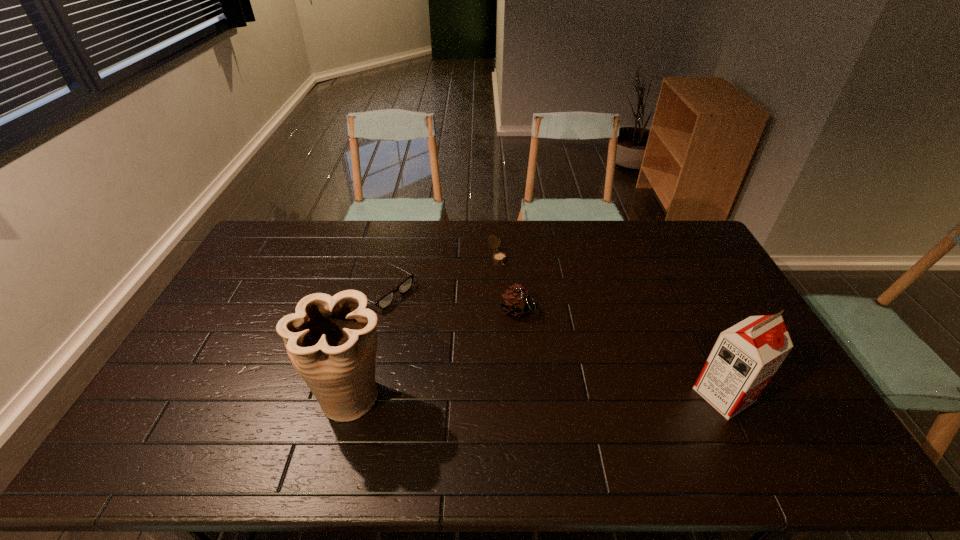
Find the location of `free space on the desktop that is between the urn and the soya milk and is positioned on the front-facing side of the shortest object`. free space on the desktop that is between the urn and the soya milk and is positioned on the front-facing side of the shortest object is located at coordinates (565, 395).

Where is `free space on the desktop that is between the urn and the soya milk and is positioned with a leaf charm attached to the third shortest object`? This screenshot has height=540, width=960. free space on the desktop that is between the urn and the soya milk and is positioned with a leaf charm attached to the third shortest object is located at coordinates (580, 395).

The width and height of the screenshot is (960, 540). In order to click on free spot on the desktop that is between the urn and the rightmost object and is positioned on the face of the compass in this screenshot , I will do `click(590, 395)`.